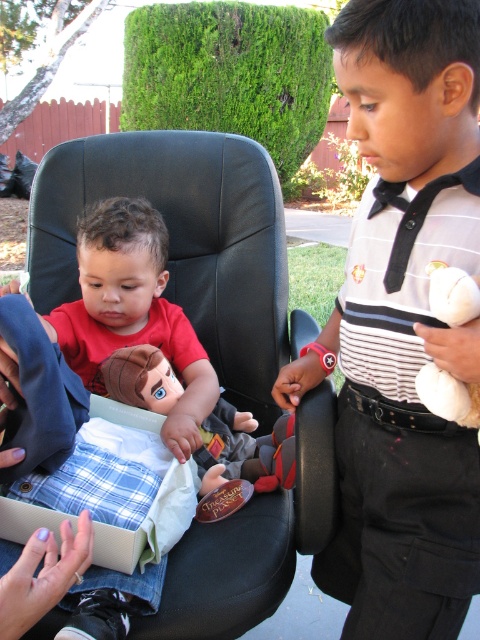
Question: Considering the real-world distances, which object is closest to the brown fabric doll at center?

Choices:
 (A) black leather armchair at center
 (B) white striped shirt at center

Answer: (A)

Question: Does brown fabric doll at center have a lesser width compared to white plush teddy bear at right?

Choices:
 (A) no
 (B) yes

Answer: (A)

Question: Does white striped shirt at center have a lesser width compared to white plush teddy bear at right?

Choices:
 (A) no
 (B) yes

Answer: (A)

Question: Which of the following is the closest to the observer?

Choices:
 (A) black leather armchair at center
 (B) white plush teddy bear at right
 (C) brown fabric doll at center

Answer: (B)

Question: Is white striped shirt at center below brown fabric doll at center?

Choices:
 (A) yes
 (B) no

Answer: (B)

Question: Among these objects, which one is farthest from the camera?

Choices:
 (A) brown fabric doll at center
 (B) white plush teddy bear at right
 (C) white striped shirt at center

Answer: (A)